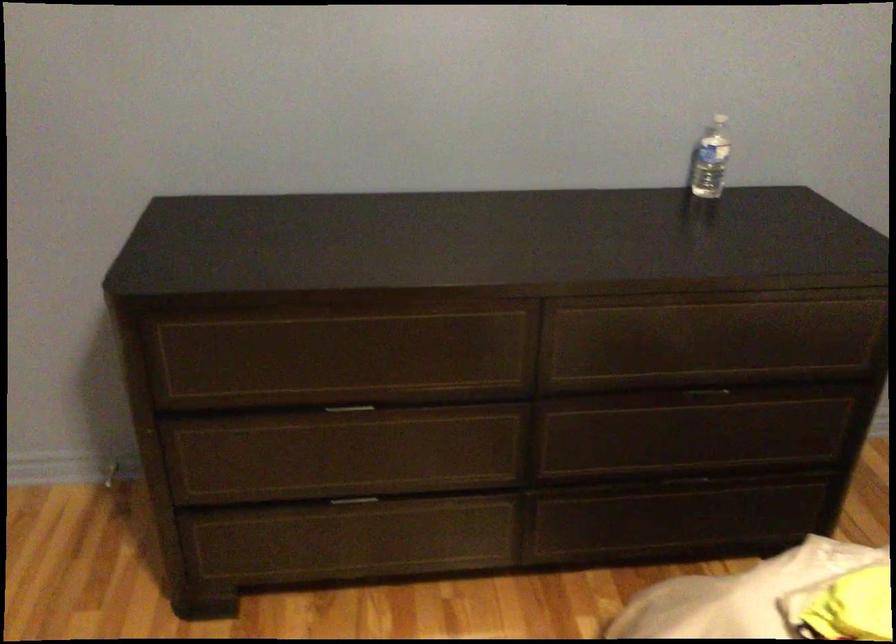
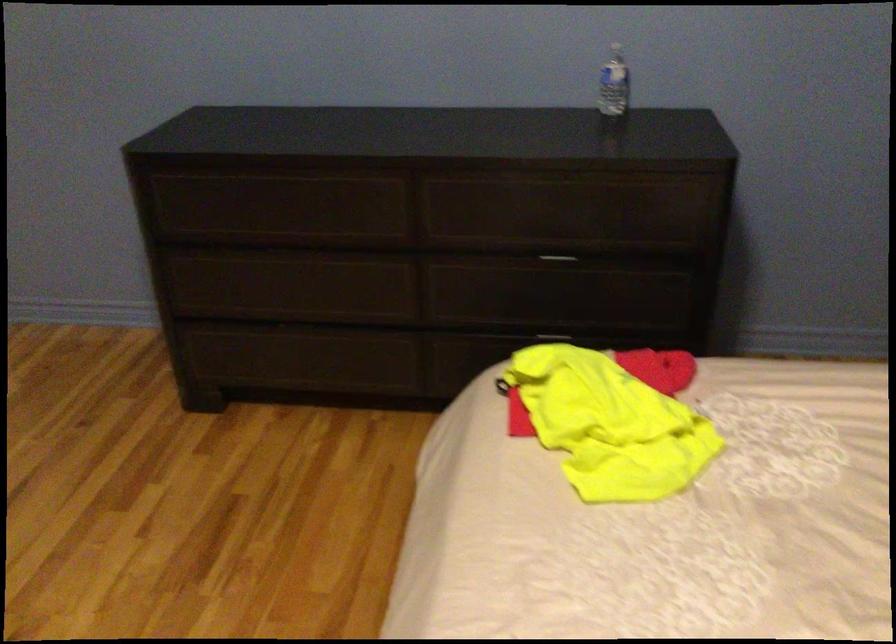
Where in the second image is the point corresponding to (712,395) from the first image?

(557, 260)